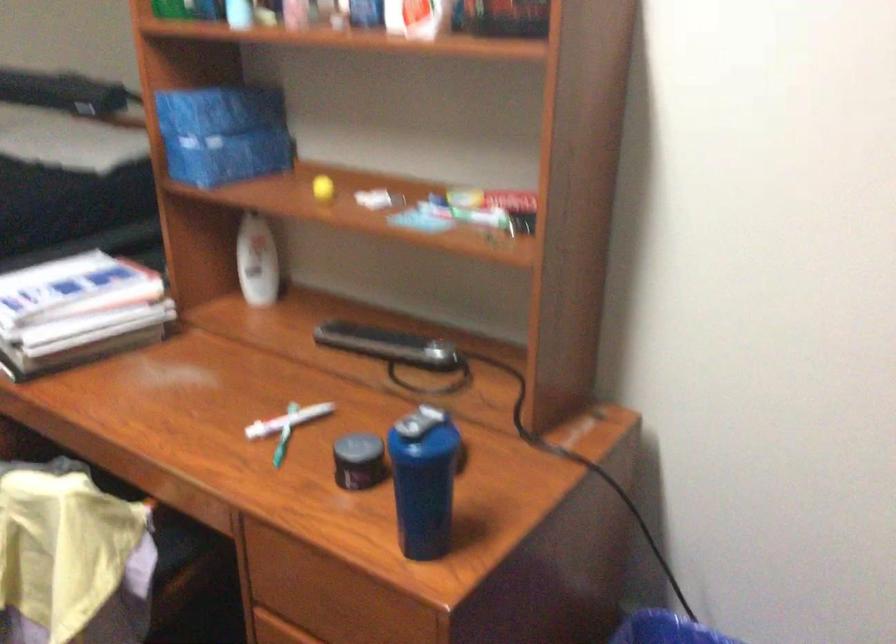
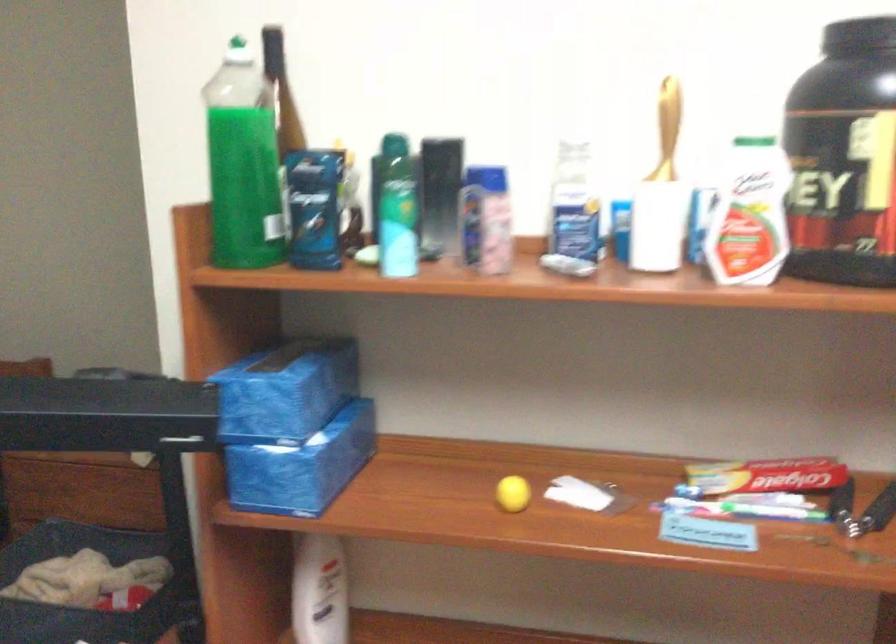
Where in the second image is the point corresponding to (x=321, y=185) from the first image?

(513, 494)